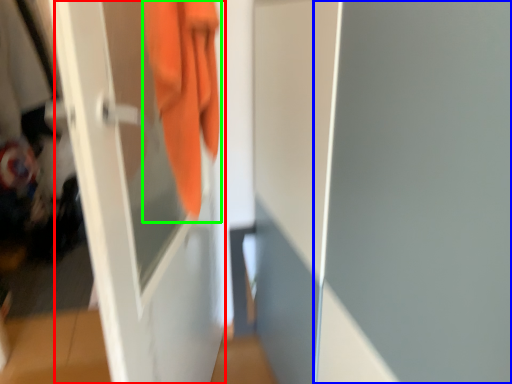
Question: Which object is positioned closest to screen door (highlighted by a red box)? Select from screen door (highlighted by a blue box) and towel (highlighted by a green box).

Choices:
 (A) screen door
 (B) towel

Answer: (B)